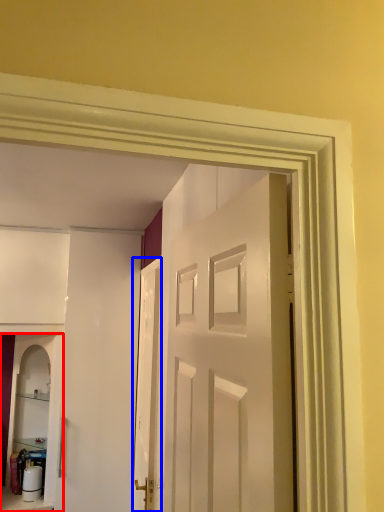
Question: Which point is further to the camera, cabinetry (highlighted by a red box) or door (highlighted by a blue box)?

Choices:
 (A) cabinetry
 (B) door

Answer: (A)